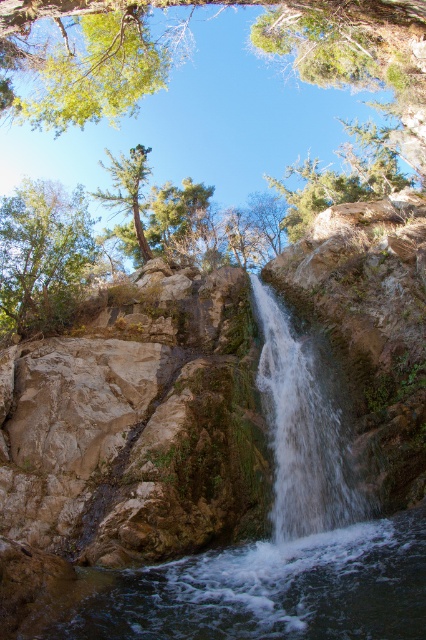
You are a photographer planning to take a wide shot of the waterfall scene. You need to ensure that the clear water at center and the green matte tree at upper center are both fully visible in the frame. Based on their widths, which object will occupy more horizontal space in the photograph?

The clear water at center will occupy more horizontal space in the photograph because its width surpasses that of the green matte tree at upper center.

In the scene shown: You are standing at the edge of the pool below the waterfall. You want to throw a pebble to hit the clear water at center. Where should you aim relative to your current position?

The clear water at center is located at point 0.923 on the x axis and 0.641 on the y axis, so you should aim towards that coordinate to hit the clear water at center.

You are a bird seeking shelter in the trees. Which tree would provide more coverage from the rain? The green leafy tree at upper left or the green matte tree at upper center?

The green matte tree at upper center provides more coverage from the rain because it is larger in size compared to the green leafy tree at upper left.